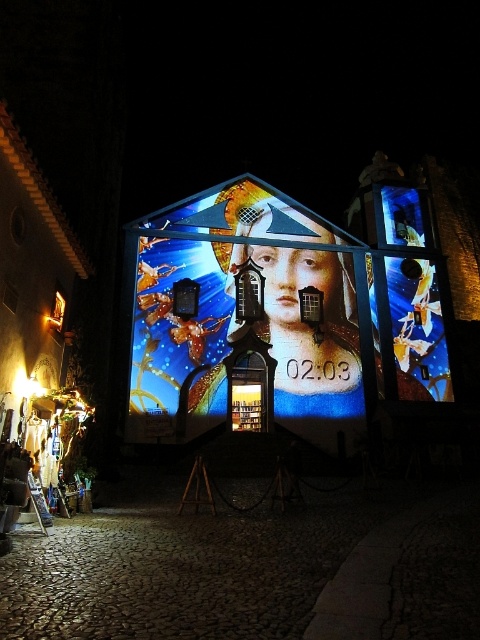
You are standing in front of the building facade with the vibrant projection. You notice two points marked on the projection at coordinates point (169, 275) and point (305, 248). Which point is closer to you?

Point (169, 275) is closer to the viewer than point (305, 248).

Looking at this image, you are an artist standing in front of the building facade. You notice the shiny metallic billboard at center and the matte gold statue at center. Which object is positioned higher on the building?

The shiny metallic billboard at center is located above the matte gold statue at center, so it is positioned higher on the building.

You are standing in front of the building facade with the vibrant projection. There is a dark cobblestone alley located at point (x=243, y=566). If you want to walk towards the dark cobblestone alley at center, which direction should you move relative to the building facade?

The dark cobblestone alley at center is located at point (x=243, y=566), so you should move towards the center of the building facade to reach it.